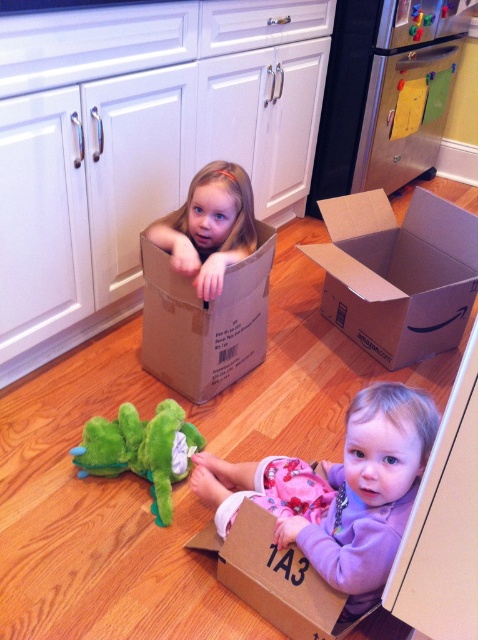
Question: Which object is the farthest from the green plush toy at lower left?

Choices:
 (A) cardboard box at center
 (B) purple soft toddler at lower center
 (C) light brown cardboard box at upper center

Answer: (A)

Question: Is the position of purple soft toddler at lower center more distant than that of green plush toy at lower left?

Choices:
 (A) yes
 (B) no

Answer: (B)

Question: Which of the following is the closest to the observer?

Choices:
 (A) (366, 522)
 (B) (474, 291)
 (C) (271, 246)

Answer: (A)

Question: Does light brown cardboard box at upper center come behind green plush toy at lower left?

Choices:
 (A) no
 (B) yes

Answer: (B)

Question: Where is brown cardboard box at center located in relation to green plush toy at lower left in the image?

Choices:
 (A) above
 (B) below

Answer: (A)

Question: Which point is farther from the camera taking this photo?

Choices:
 (A) (285, 480)
 (B) (328, 221)
 (C) (230, 339)

Answer: (B)